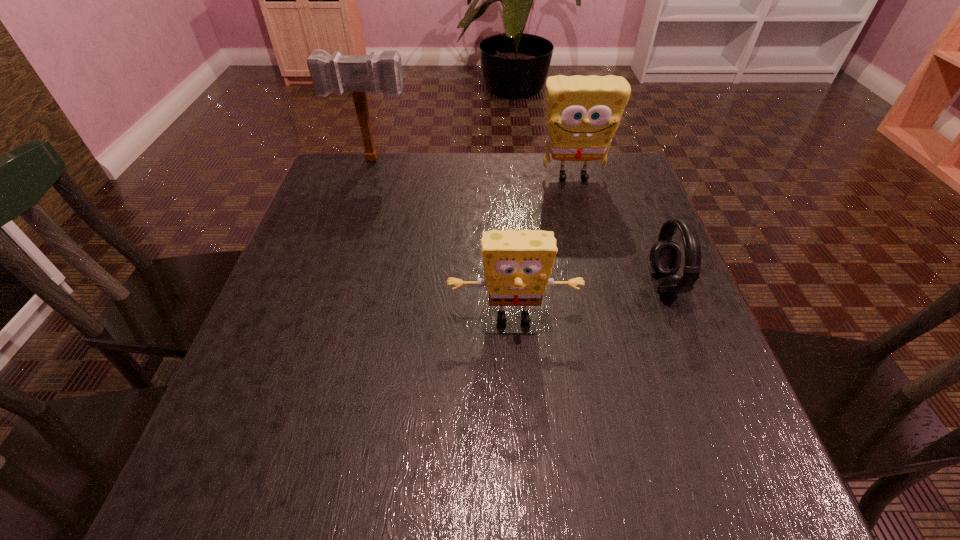
Locate an element on the screen. The height and width of the screenshot is (540, 960). vacant space that is in between the nearer sponge and the farthest object is located at coordinates (444, 239).

Where is `vacant space in between the mallet and the farther sponge`? The height and width of the screenshot is (540, 960). vacant space in between the mallet and the farther sponge is located at coordinates (473, 168).

Where is `the second closest object to the taller sponge`? the second closest object to the taller sponge is located at coordinates (358, 74).

Where is `object that is the third closest one to the rightmost object`? The image size is (960, 540). object that is the third closest one to the rightmost object is located at coordinates (358, 74).

Locate an element on the screen. free space in the image that satisfies the following two spatial constraints: 1. on the earcups of the rightmost object; 2. on the face of the nearer sponge is located at coordinates (679, 317).